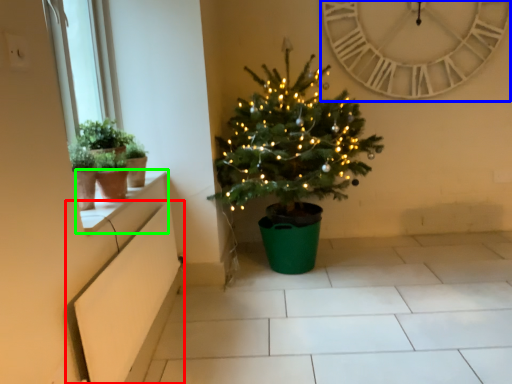
Question: Which object is the closest to the window box (highlighted by a red box)? Choose among these: clock (highlighted by a blue box) or window sill (highlighted by a green box).

Choices:
 (A) clock
 (B) window sill

Answer: (B)